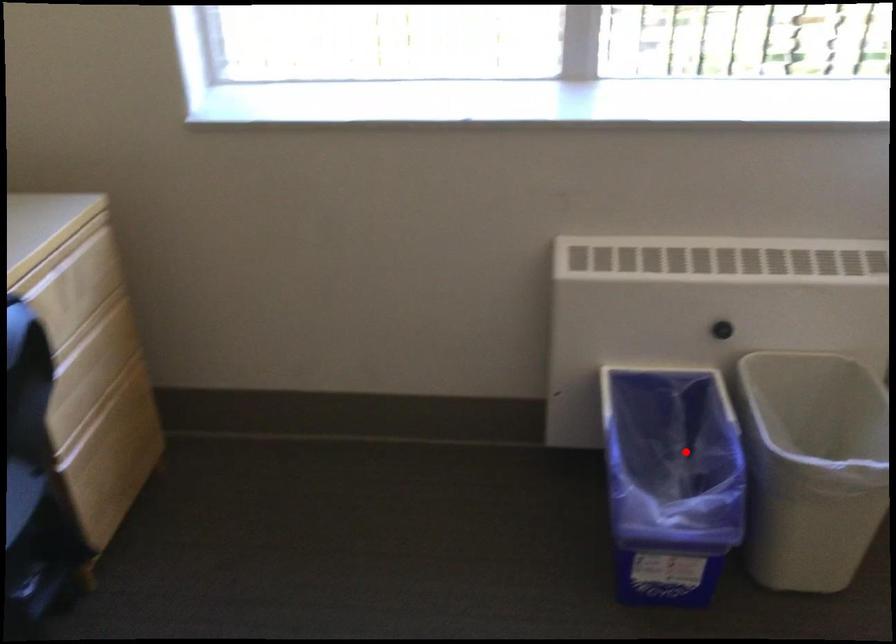
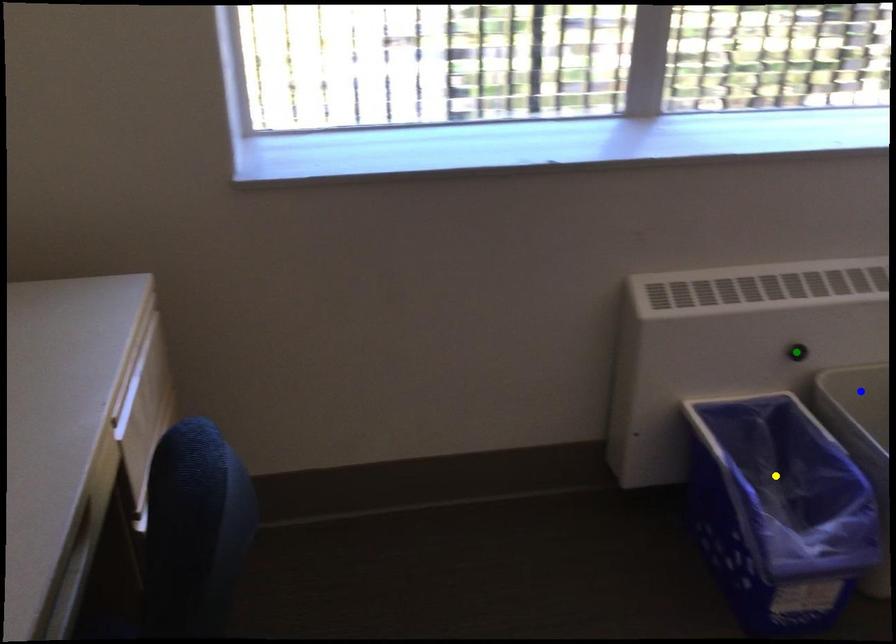
Question: I am providing you with two images of the same scene from different viewpoints. A red point is marked on the first image. You are given multiple points on the second image. Which point in image 2 represents the same 3d spot as the red point in image 1?

Choices:
 (A) blue point
 (B) yellow point
 (C) green point

Answer: (B)